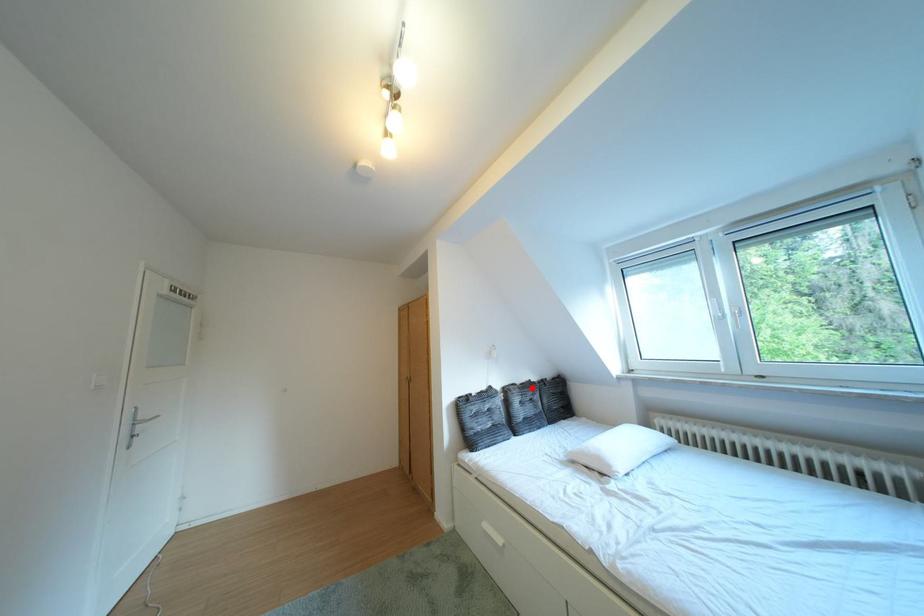
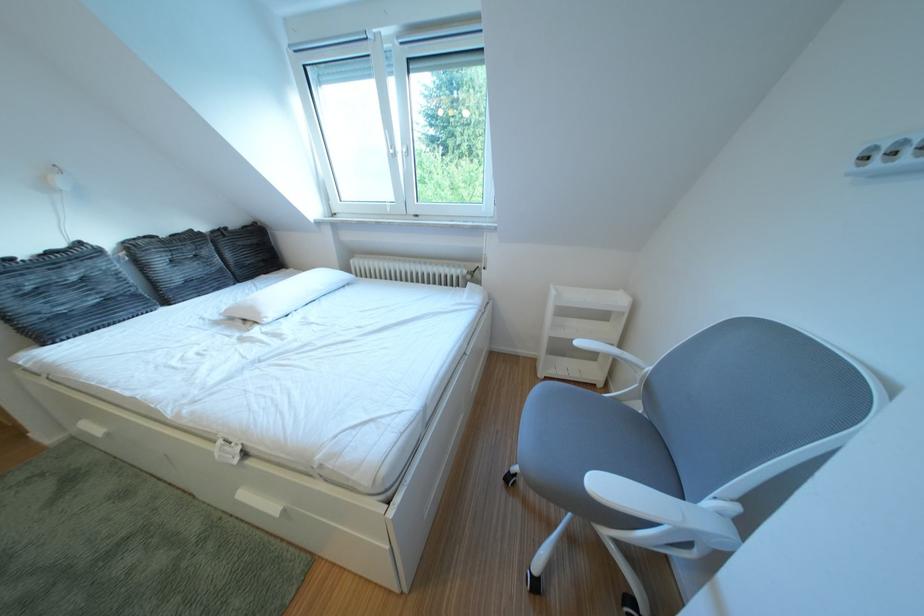
The point at the highlighted location is marked in the first image. Where is the corresponding point in the second image?

(176, 240)